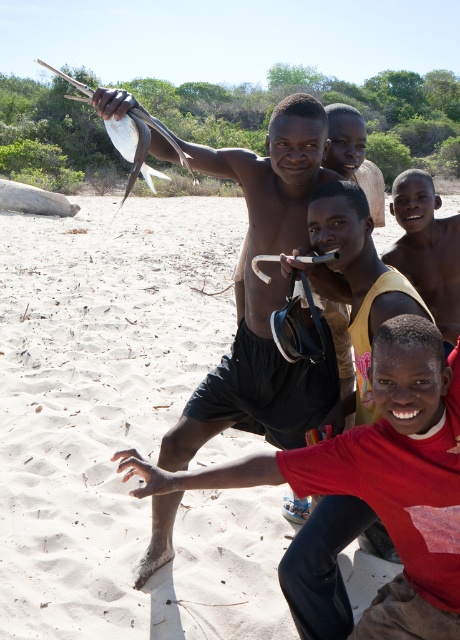
Question: Which point is closer to the camera taking this photo?

Choices:
 (A) (431, 186)
 (B) (427, 460)
 (C) (257, 381)

Answer: (B)

Question: Is red cotton shirt at lower right above smooth yellow shirt at center?

Choices:
 (A) no
 (B) yes

Answer: (A)

Question: Which object is closer to the camera taking this photo?

Choices:
 (A) red cotton shirt at lower right
 (B) matte yellow shirt at center
 (C) smooth skin man at center

Answer: (A)

Question: Is smooth skin man at center below matte yellow shirt at center?

Choices:
 (A) yes
 (B) no

Answer: (A)

Question: Considering the relative positions of red cotton shirt at lower right and matte yellow shirt at center in the image provided, where is red cotton shirt at lower right located with respect to matte yellow shirt at center?

Choices:
 (A) right
 (B) left

Answer: (B)

Question: Which of these objects is positioned closest to the red cotton shirt at lower right?

Choices:
 (A) smooth yellow shirt at center
 (B) smooth skin man at center

Answer: (A)